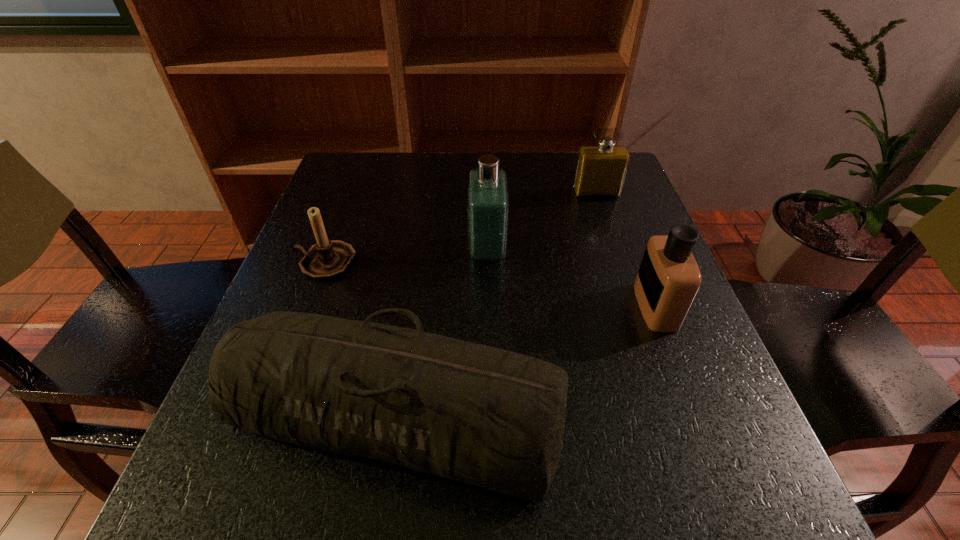
Find the location of a particular element. the leftmost perfume is located at coordinates (488, 200).

The image size is (960, 540). I want to click on the tallest perfume, so click(488, 200).

Image resolution: width=960 pixels, height=540 pixels. I want to click on the nearest perfume, so pos(668,279).

At what (x,y) coordinates should I click in order to perform the action: click on the farthest object. Please return your answer as a coordinate pair (x, y). The image size is (960, 540). Looking at the image, I should click on (601, 169).

You are a GUI agent. You are given a task and a screenshot of the screen. Output one action in this format:
    pyautogui.click(x=<x>, y=<y>)
    Task: Click on the nearest object
    The image size is (960, 540).
    Given the screenshot: What is the action you would take?
    pyautogui.click(x=492, y=418)

Locate an element on the screen. Image resolution: width=960 pixels, height=540 pixels. candle holder is located at coordinates (326, 260).

Locate an element on the screen. The width and height of the screenshot is (960, 540). vacant space located on the front label of the tallest object is located at coordinates (342, 251).

Identify the location of free space located 0.220m on the front label of the tallest object. (369, 251).

This screenshot has width=960, height=540. I want to click on vacant space located on the front label of the tallest object, so click(332, 251).

The height and width of the screenshot is (540, 960). I want to click on free point located on the front label of the second nearest object, so click(x=483, y=306).